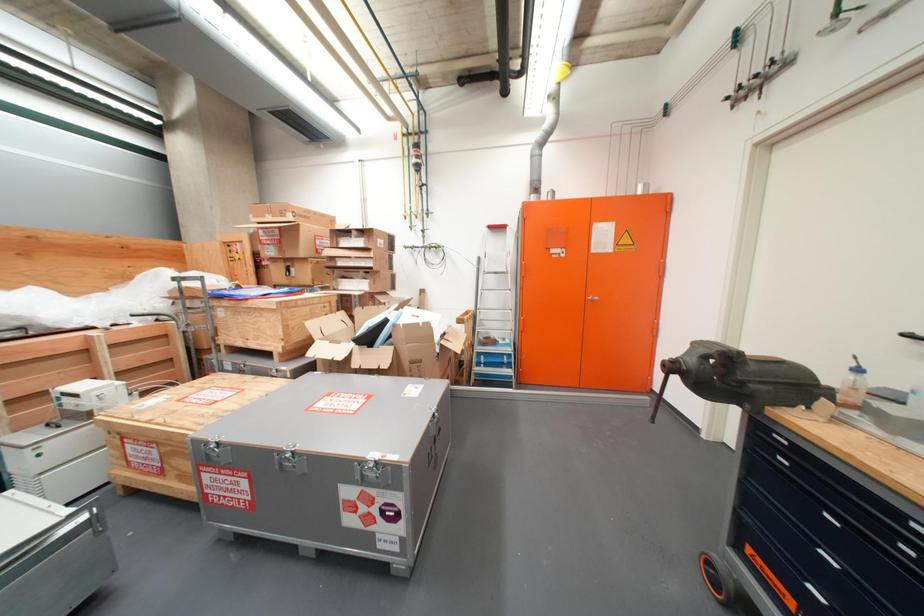
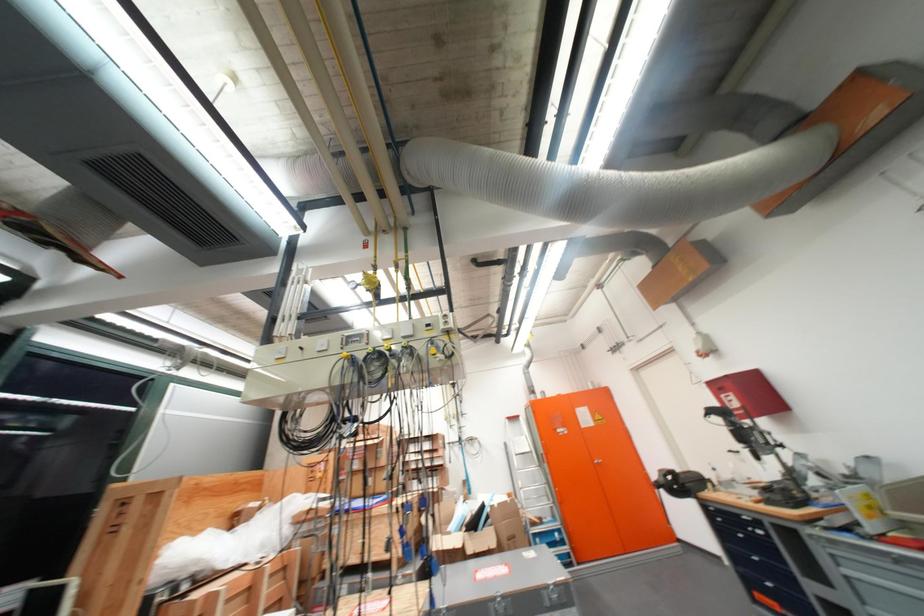
Locate, in the second image, the point that corresponds to point (604, 302) in the first image.

(611, 464)